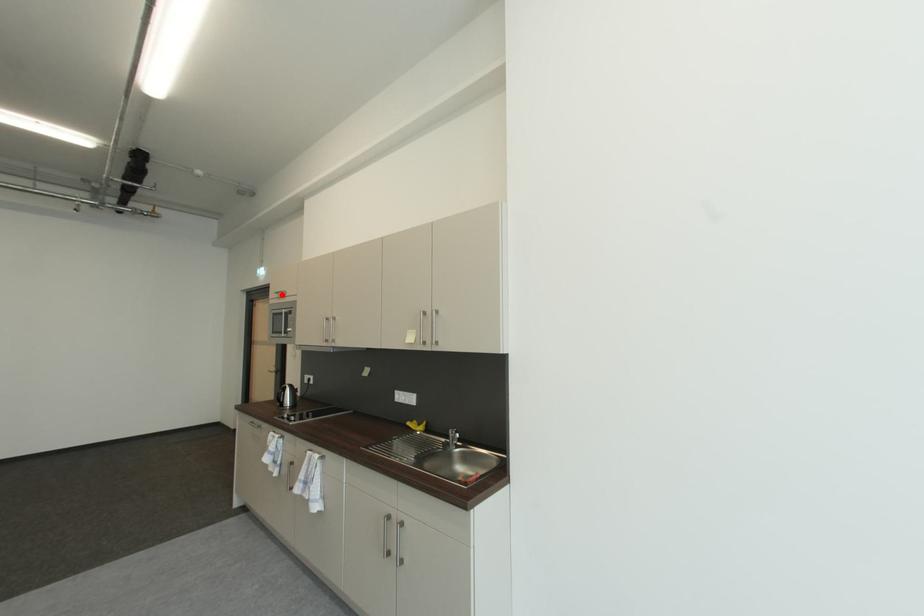
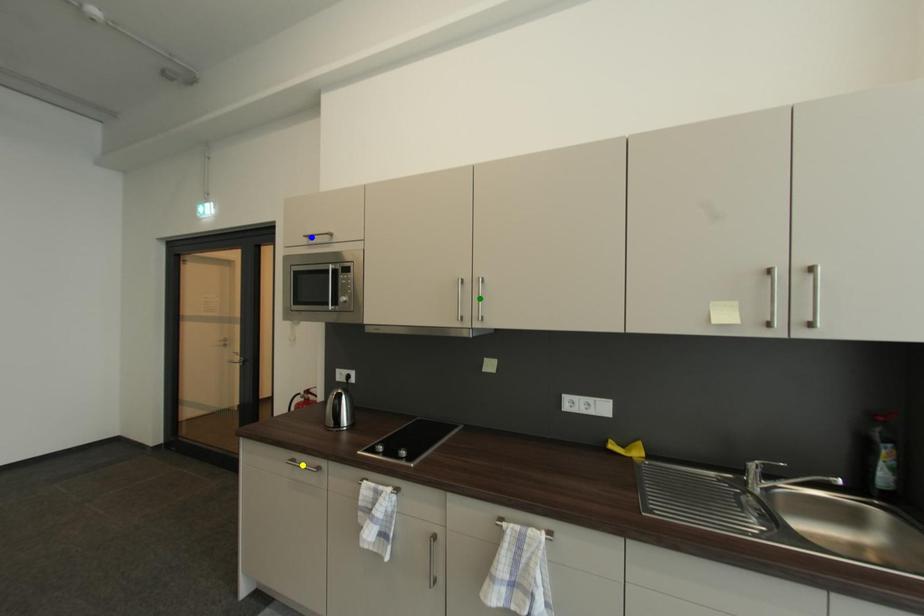
Question: I am providing you with two images of the same scene from different viewpoints. A red point is marked on the first image. You are given multiple points on the second image. Which mark in image 2 goes with the point in image 1?

Choices:
 (A) yellow point
 (B) blue point
 (C) green point

Answer: (B)